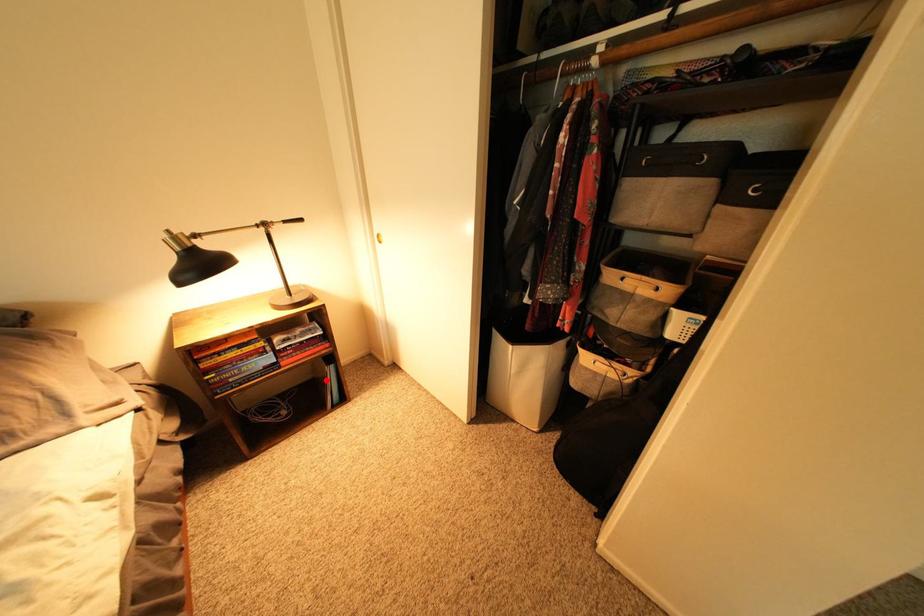
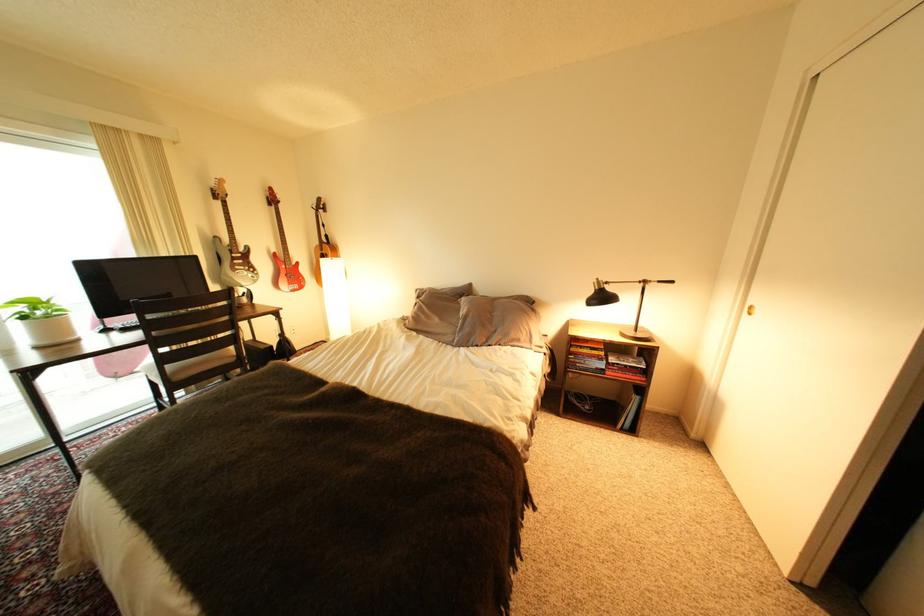
The point at the highlighted location is marked in the first image. Where is the corresponding point in the second image?

(628, 403)